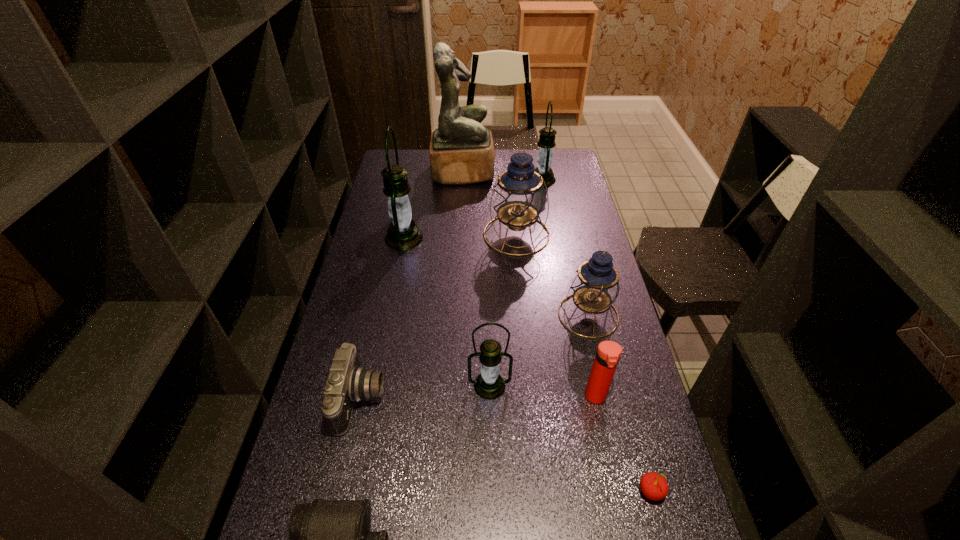
In order to click on free location located on the front-facing side of the farther blue lantern in this screenshot , I will do `click(525, 323)`.

Locate an element on the screen. Image resolution: width=960 pixels, height=540 pixels. vacant space located 0.070m on the side where the nearest green lantern emits light is located at coordinates (491, 424).

The width and height of the screenshot is (960, 540). I want to click on free point located 0.160m on the front-facing side of the nearer blue lantern, so click(x=509, y=315).

Locate an element on the screen. This screenshot has width=960, height=540. free spot located on the front-facing side of the nearer blue lantern is located at coordinates (446, 315).

Where is `free point located 0.070m on the front-facing side of the nearer blue lantern`? This screenshot has height=540, width=960. free point located 0.070m on the front-facing side of the nearer blue lantern is located at coordinates (537, 315).

You are a GUI agent. You are given a task and a screenshot of the screen. Output one action in this format:
    pyautogui.click(x=<x>, y=<y>)
    Task: Click on the free space located on the left of the thermos bottle
    The image size is (960, 540).
    Given the screenshot: What is the action you would take?
    pyautogui.click(x=439, y=397)

This screenshot has width=960, height=540. I want to click on free region located on the front-facing side of the camera, so click(x=453, y=399).

You are a GUI agent. You are given a task and a screenshot of the screen. Output one action in this format:
    pyautogui.click(x=<x>, y=<y>)
    Task: Click on the vacant space located on the back of the cherry
    
    Given the screenshot: What is the action you would take?
    (x=624, y=390)

Identify the location of sculpture located in the far edge section of the desktop. (461, 151).

Where is `lantern positioned at the far edge`? This screenshot has width=960, height=540. lantern positioned at the far edge is located at coordinates (546, 142).